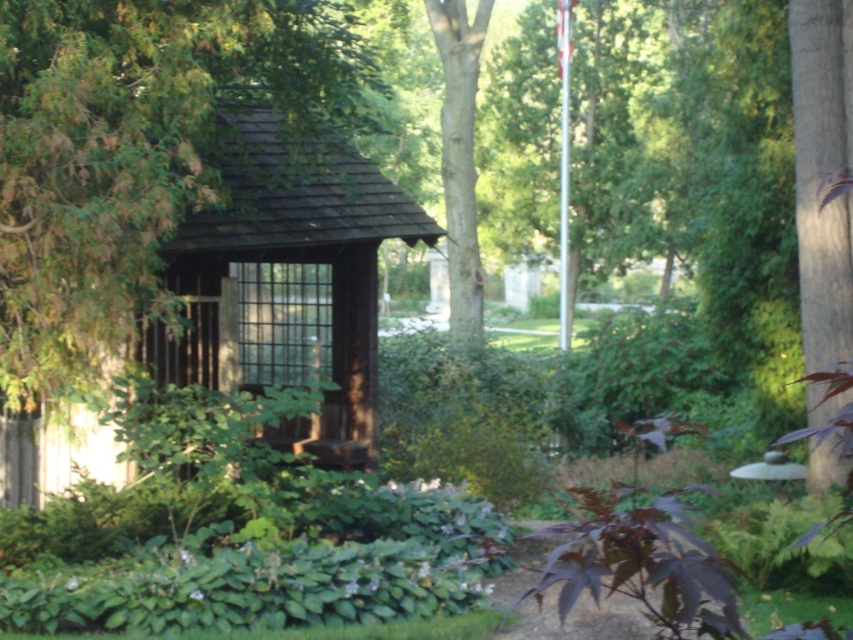
You are planning to place a small garden statue between the brown wooden hut at center and the green textured bark at right. Which object should you place the statue closer to if you want it to be closer to the larger object?

You should place the statue closer to the brown wooden hut at center because it is larger than the green textured bark at right.

You are a hiker who wants to identify the tallest tree in the area. You see the green textured bark at right and the smooth brown bark at upper center. Which one is taller?

The green textured bark at right is much taller than the smooth brown bark at upper center, so the green textured bark at right is the taller one.